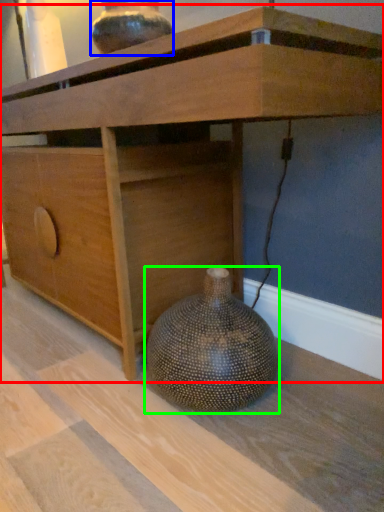
Question: Considering the real-world distances, which object is closest to table (highlighted by a red box)? vase (highlighted by a blue box) or vase (highlighted by a green box).

Choices:
 (A) vase
 (B) vase

Answer: (A)